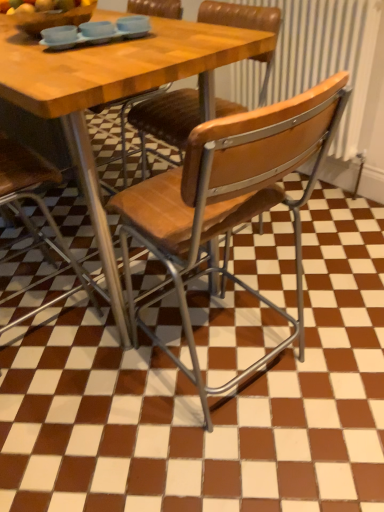
This screenshot has width=384, height=512. Find the location of `blank space situated above wooden bowl at upper left (from a real-world perspective)`. blank space situated above wooden bowl at upper left (from a real-world perspective) is located at coordinates (49, 5).